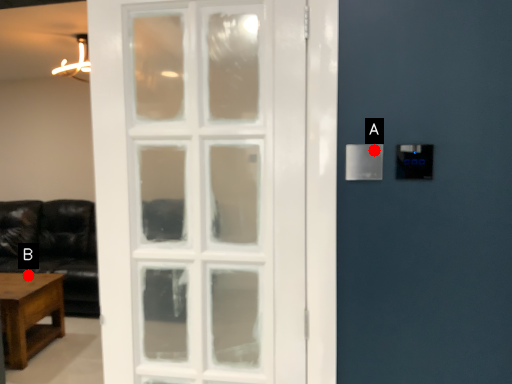
Question: Two points are circled on the image, labeled by A and B beside each circle. Which point is farther to the camera?

Choices:
 (A) A is further
 (B) B is further

Answer: (B)